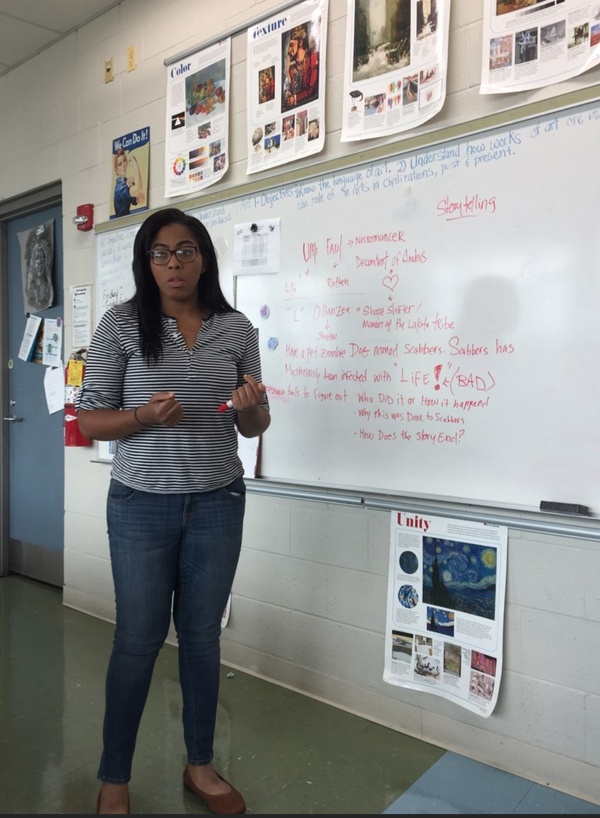
At what (x,y) coordinates should I click in order to perform the action: click on white board eraser. Please return your answer as a coordinate pair (x, y). This screenshot has height=818, width=600. Looking at the image, I should click on (578, 504).